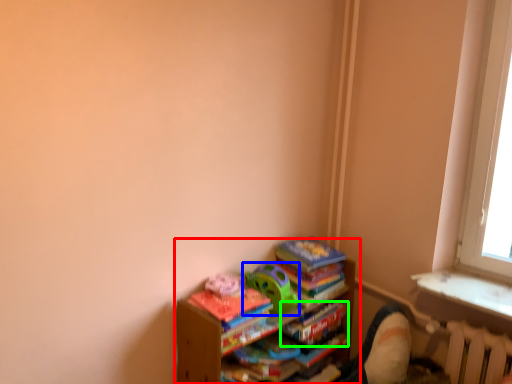
Question: Based on their relative distances, which object is farther from shelf (highlighted by a red box)? Choose from toy (highlighted by a blue box) and paperback book (highlighted by a green box).

Choices:
 (A) toy
 (B) paperback book

Answer: (B)